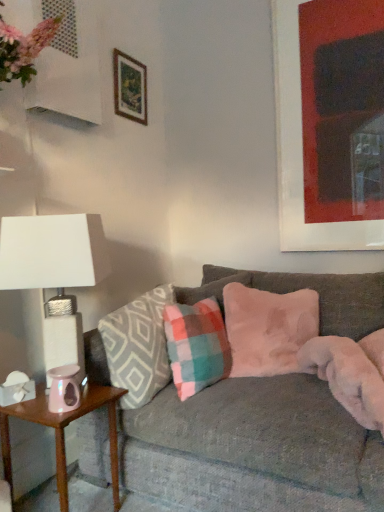
Question: Should I look upward or downward to see plaid fabric pillow at center, which is the first pillow from left to right?

Choices:
 (A) up
 (B) down

Answer: (B)

Question: Can you confirm if white textured lampshade at left is shorter than pink glossy side table at lower left?

Choices:
 (A) no
 (B) yes

Answer: (A)

Question: Does white textured lampshade at left lie in front of pink glossy side table at lower left?

Choices:
 (A) no
 (B) yes

Answer: (A)

Question: Is pink glossy side table at lower left surrounded by white textured lampshade at left?

Choices:
 (A) no
 (B) yes

Answer: (A)

Question: Does white textured lampshade at left touch pink glossy side table at lower left?

Choices:
 (A) yes
 (B) no

Answer: (B)

Question: Would you say white textured lampshade at left is a long distance from pink glossy side table at lower left?

Choices:
 (A) yes
 (B) no

Answer: (B)

Question: Considering the relative sizes of white textured lampshade at left and pink glossy side table at lower left in the image provided, is white textured lampshade at left bigger than pink glossy side table at lower left?

Choices:
 (A) no
 (B) yes

Answer: (B)

Question: Considering the relative positions of fuzzy pink pillow at center, arranged as the third pillow when viewed from the left, and white textured lampshade at left in the image provided, is fuzzy pink pillow at center, arranged as the third pillow when viewed from the left, in front of white textured lampshade at left?

Choices:
 (A) no
 (B) yes

Answer: (A)

Question: Considering the relative positions of fuzzy pink pillow at center, arranged as the third pillow when viewed from the left, and white textured lampshade at left in the image provided, is fuzzy pink pillow at center, arranged as the third pillow when viewed from the left, behind white textured lampshade at left?

Choices:
 (A) no
 (B) yes

Answer: (B)

Question: Does fuzzy pink pillow at center, arranged as the third pillow when viewed from the left, have a greater width compared to white textured lampshade at left?

Choices:
 (A) yes
 (B) no

Answer: (A)

Question: Is fuzzy pink pillow at center, the 1th pillow from the right, not within white textured lampshade at left?

Choices:
 (A) yes
 (B) no

Answer: (A)

Question: From a real-world perspective, is fuzzy pink pillow at center, the 1th pillow from the right, below white textured lampshade at left?

Choices:
 (A) no
 (B) yes

Answer: (B)

Question: From the image's perspective, is fuzzy pink pillow at center, the 1th pillow from the right, beneath white textured lampshade at left?

Choices:
 (A) yes
 (B) no

Answer: (A)

Question: Does iridescent glass candle holder at lower left have a greater width compared to matte black picture frame at upper right, the second picture frame from the left?

Choices:
 (A) no
 (B) yes

Answer: (B)